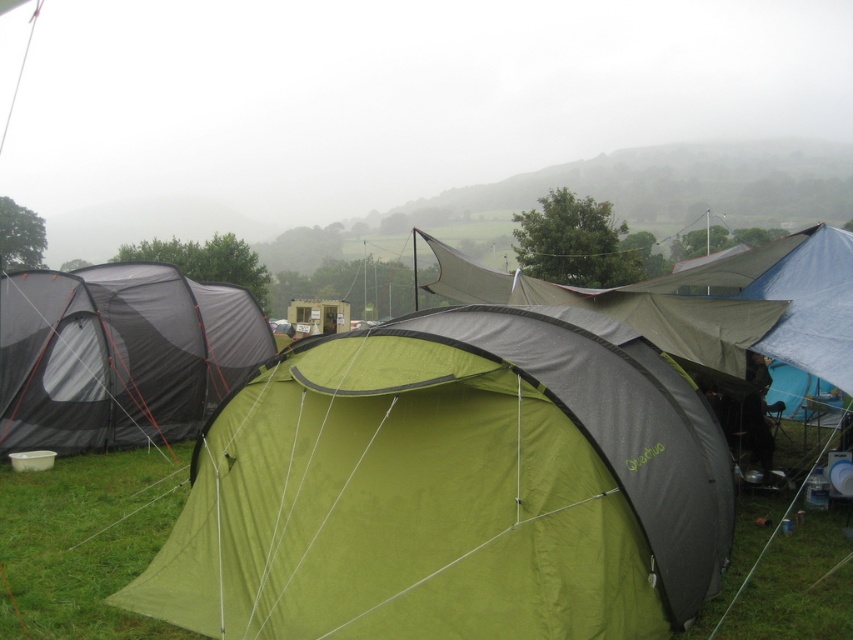
Who is shorter, green fabric tent at center or green fabric canopy at center?

green fabric tent at center

From the picture: Which of these two, green fabric tent at center or green fabric canopy at center, stands taller?

green fabric canopy at center

Is point (322, 611) positioned behind point (665, 339)?

No, it is not.

This screenshot has height=640, width=853. What are the coordinates of `green fabric tent at center` in the screenshot? It's located at (451, 488).

Between black mesh tent at left and green fabric canopy at center, which one appears on the left side from the viewer's perspective?

From the viewer's perspective, black mesh tent at left appears more on the left side.

Which is behind, point (131, 346) or point (675, 312)?

Point (131, 346)

Between point (47, 301) and point (476, 292), which one is positioned in front?

Point (47, 301)

Find the location of a particular element. Image resolution: width=853 pixels, height=640 pixels. black mesh tent at left is located at coordinates (119, 355).

How much distance is there between green fabric tent at center and black mesh tent at left?

green fabric tent at center is 6.62 meters from black mesh tent at left.

In the scene shown: Who is lower down, green fabric tent at center or black mesh tent at left?

green fabric tent at center is below.

Is point (668, 433) less distant than point (119, 280)?

Yes, it is.

At what (x,y) coordinates should I click in order to perform the action: click on green fabric tent at center. Please return your answer as a coordinate pair (x, y). Looking at the image, I should click on (451, 488).